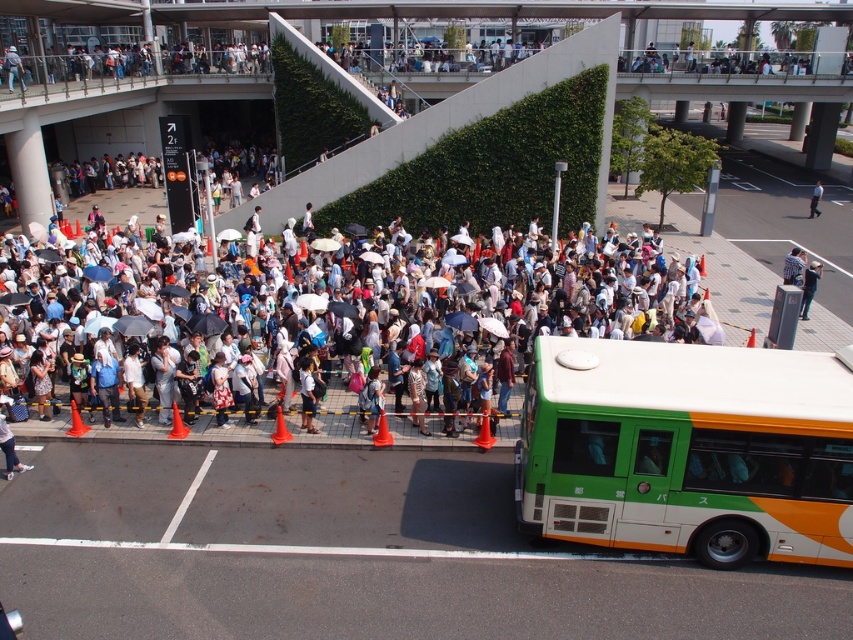
Question: Is matte white crowd at center smaller than light blue fabric jacket at center?

Choices:
 (A) no
 (B) yes

Answer: (A)

Question: Which point is farther to the camera?

Choices:
 (A) matte white crowd at center
 (B) green matte bus at lower right
 (C) light blue fabric jacket at center
 (D) white fabric shirt at center

Answer: (D)

Question: Which point appears farthest from the camera in this image?

Choices:
 (A) (611, 328)
 (B) (804, 272)
 (C) (579, 388)
 (D) (816, 182)

Answer: (D)

Question: Is green matte bus at lower right thinner than matte white crowd at center?

Choices:
 (A) no
 (B) yes

Answer: (B)

Question: Among these objects, which one is farthest from the camera?

Choices:
 (A) green matte bus at lower right
 (B) white fabric shirt at center

Answer: (B)

Question: Is green matte bus at lower right closer to camera compared to light blue fabric jacket at center?

Choices:
 (A) no
 (B) yes

Answer: (B)